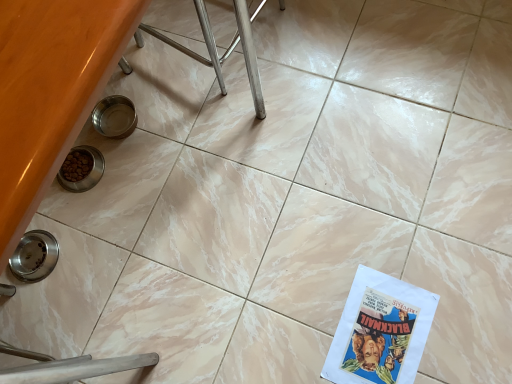
Identify the location of free space in front of brushed metal stool at upper center. (246, 130).